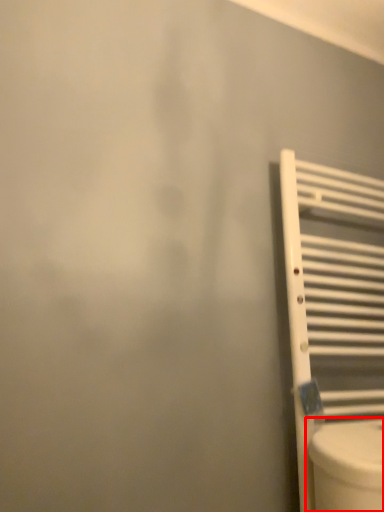
Question: From the image, what is the correct spatial relationship of toilet (annotated by the red box) in relation to radiator?

Choices:
 (A) left
 (B) right

Answer: (A)